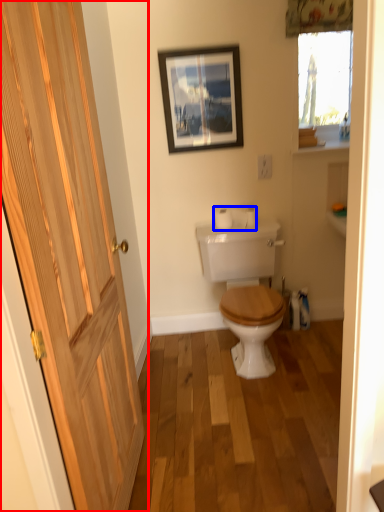
Question: Which point is further to the camera, door (highlighted by a red box) or toilet paper (highlighted by a blue box)?

Choices:
 (A) door
 (B) toilet paper

Answer: (B)